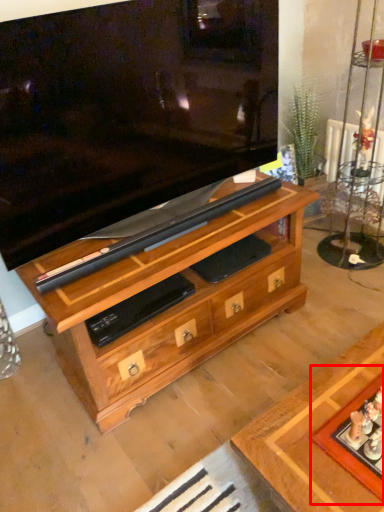
Question: Observing the image, what is the correct spatial positioning of board game (annotated by the red box) in reference to chest of drawers?

Choices:
 (A) right
 (B) left

Answer: (A)